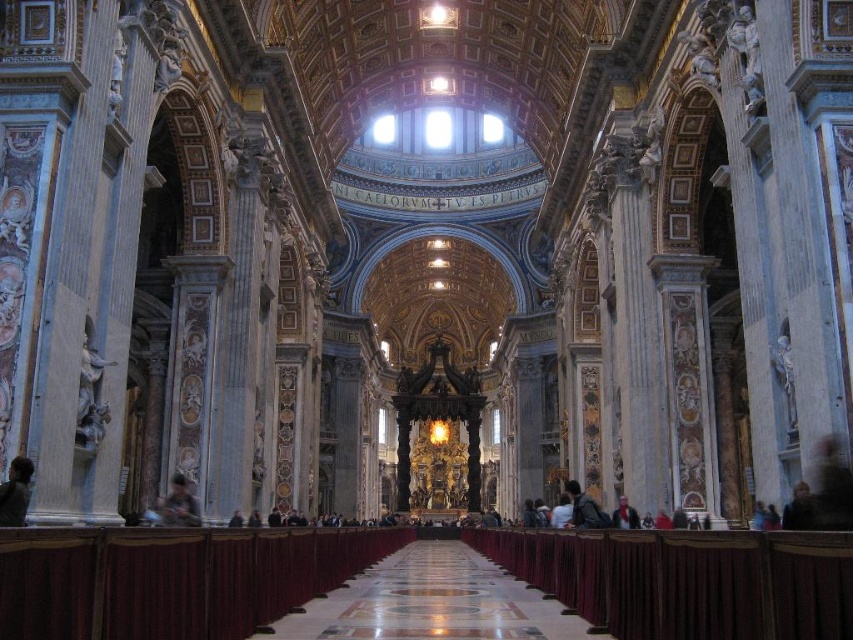
Question: Among these objects, which one is nearest to the camera?

Choices:
 (A) dark gray fabric coat at lower center
 (B) brown leather jacket at lower left
 (C) dark gray suit at center

Answer: (B)

Question: Among these points, which one is farthest from the camera?

Choices:
 (A) (573, 480)
 (B) (791, 508)
 (C) (3, 497)

Answer: (A)

Question: Estimate the real-world distances between objects in this image. Which object is closer to the dark gray fabric coat at lower center?

Choices:
 (A) white fabric person at center
 (B) dark gray suit at center
 (C) marble floor at center

Answer: (B)

Question: Is marble floor at center wider than brown leather jacket at lower left?

Choices:
 (A) yes
 (B) no

Answer: (A)

Question: In this image, where is dark gray fabric coat at lower center located relative to dark gray suit at center?

Choices:
 (A) right
 (B) left

Answer: (B)

Question: Does brown leather jacket at lower left lie behind dark gray fabric coat at lower center?

Choices:
 (A) yes
 (B) no

Answer: (B)